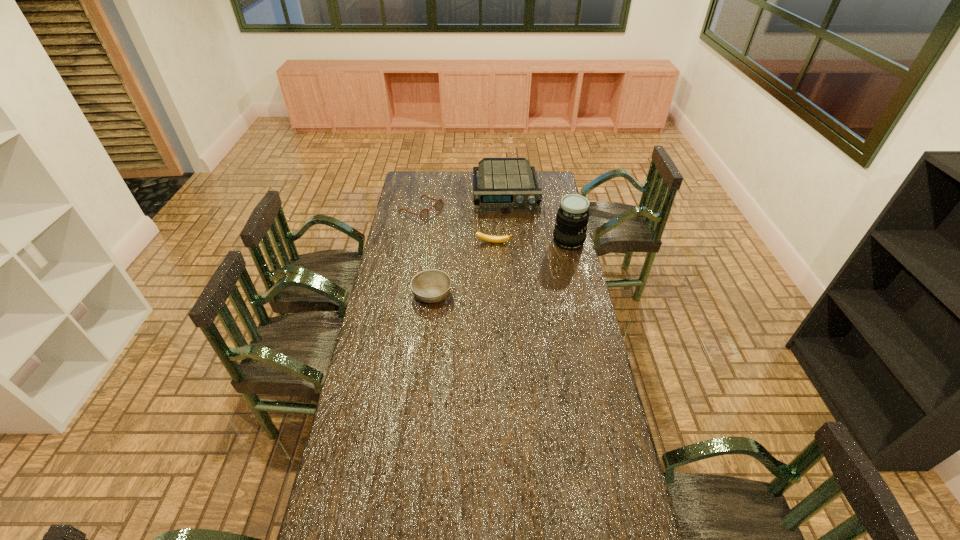
The image size is (960, 540). Identify the location of vacant area situated 0.350m on the front panel of the fourth shortest object. (513, 256).

At what (x,y) coordinates should I click in order to perform the action: click on free space located 0.140m on the front-facing side of the spectacles. Please return your answer as a coordinate pair (x, y). Image resolution: width=960 pixels, height=540 pixels. Looking at the image, I should click on (458, 228).

Locate an element on the screen. This screenshot has height=540, width=960. free region located 0.050m on the front-facing side of the spectacles is located at coordinates (444, 221).

Identify the location of free space located 0.140m on the front-facing side of the spectacles. This screenshot has width=960, height=540. (458, 228).

The image size is (960, 540). I want to click on vacant space located at the stem of the banana, so click(x=492, y=302).

At what (x,y) coordinates should I click in order to perform the action: click on vacant area situated 0.380m at the stem of the banana. Please return your answer as a coordinate pair (x, y). This screenshot has width=960, height=540. Looking at the image, I should click on (492, 300).

At what (x,y) coordinates should I click in order to perform the action: click on vacant area situated 0.250m at the stem of the banana. Please return your answer as a coordinate pair (x, y). This screenshot has width=960, height=540. Looking at the image, I should click on (492, 280).

Locate an element on the screen. This screenshot has height=540, width=960. object that is at the far edge is located at coordinates (506, 185).

What are the coordinates of `bowl located at the left edge` in the screenshot? It's located at (431, 286).

At what (x,y) coordinates should I click in order to perform the action: click on spectacles at the left edge. Please return your answer as a coordinate pair (x, y). The height and width of the screenshot is (540, 960). Looking at the image, I should click on 424,213.